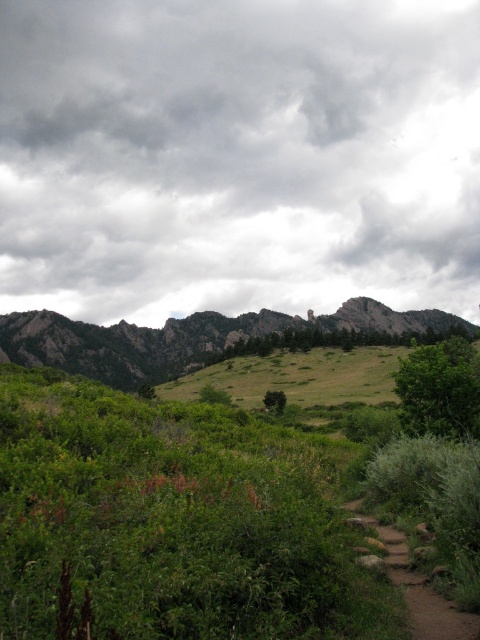
Question: Which point is closer to the camera?

Choices:
 (A) (432, 609)
 (B) (300, 321)
 (C) (384, 632)

Answer: (C)

Question: From the image, what is the correct spatial relationship of green grassy hill at center in relation to brown dirt path at lower right?

Choices:
 (A) above
 (B) below

Answer: (B)

Question: Is green leafy shrubs at center bigger than green grassy hill at center?

Choices:
 (A) no
 (B) yes

Answer: (A)

Question: Among these objects, which one is farthest from the camera?

Choices:
 (A) green grassy hill at center
 (B) green leafy shrubs at center
 (C) cloudy gray sky at upper center

Answer: (C)

Question: Can you confirm if green leafy tree at center-right is smaller than brown dirt path at lower right?

Choices:
 (A) no
 (B) yes

Answer: (A)

Question: Which of these objects is positioned closest to the green grassy hill at center?

Choices:
 (A) green leafy tree at center-right
 (B) brown dirt path at lower right

Answer: (A)